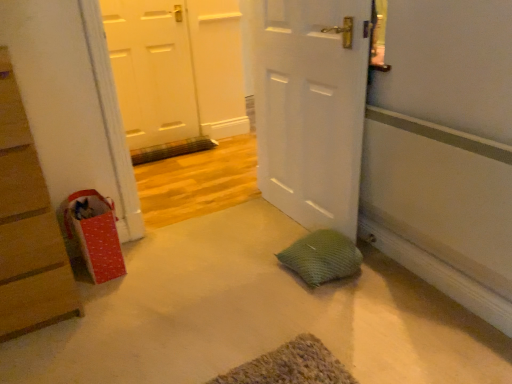
Where is `vacant space in between red cardboard chest of drawers at left and red dotted paper bag at left`? The height and width of the screenshot is (384, 512). vacant space in between red cardboard chest of drawers at left and red dotted paper bag at left is located at coordinates point(101,294).